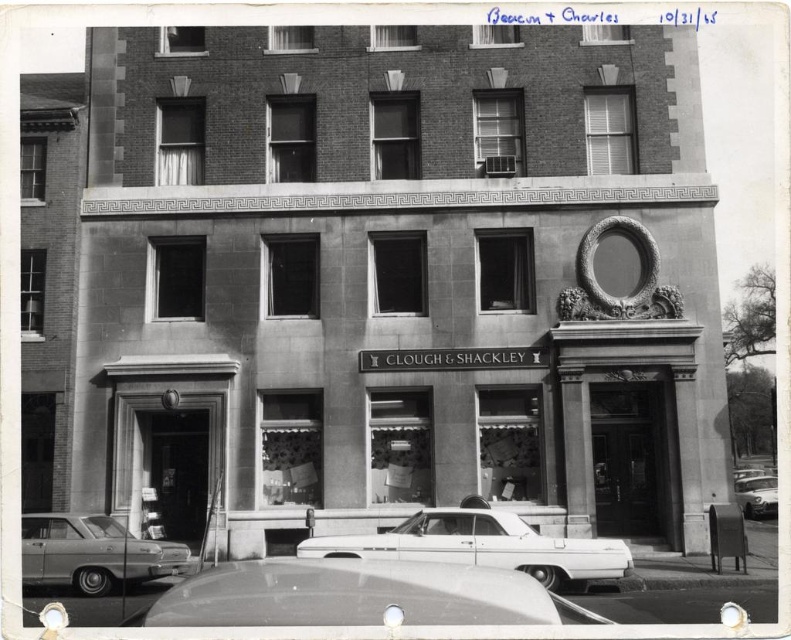
Question: Which of the following is the closest to the observer?

Choices:
 (A) metallic gray sedan at lower left
 (B) shiny white sedan at center
 (C) shiny silver car at lower center
 (D) shiny silver car at lower right

Answer: (C)

Question: Considering the real-world distances, which object is farthest from the metallic gray sedan at lower left?

Choices:
 (A) shiny silver car at lower center
 (B) shiny white sedan at center

Answer: (A)

Question: Among these objects, which one is farthest from the camera?

Choices:
 (A) metallic gray sedan at lower left
 (B) shiny white sedan at center
 (C) shiny silver car at lower center
 (D) shiny silver car at lower right

Answer: (D)

Question: Is metallic gray sedan at lower left below shiny silver car at lower right?

Choices:
 (A) no
 (B) yes

Answer: (A)

Question: Is shiny white sedan at center to the right of metallic gray sedan at lower left from the viewer's perspective?

Choices:
 (A) yes
 (B) no

Answer: (A)

Question: Is shiny silver car at lower center further to the viewer compared to metallic gray sedan at lower left?

Choices:
 (A) no
 (B) yes

Answer: (A)